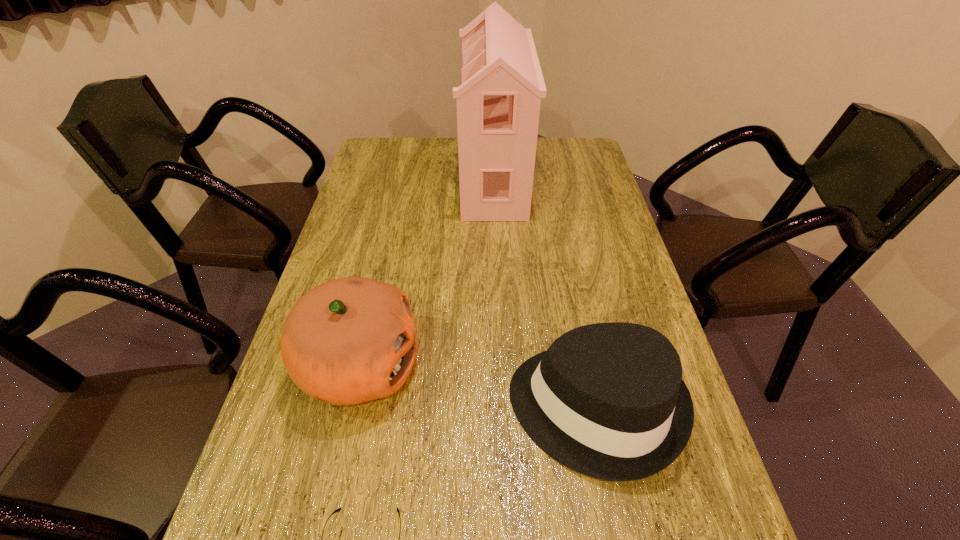
Locate an element on the screen. the tallest object is located at coordinates (498, 103).

In order to click on dollhouse in this screenshot , I will do `click(498, 103)`.

Find the location of `the second tallest object`. the second tallest object is located at coordinates (350, 340).

The height and width of the screenshot is (540, 960). Find the location of `fedora`. fedora is located at coordinates (607, 400).

Identify the location of vacant region located on the front-facing side of the tallest object. (401, 178).

Find the location of `vacant space located 0.340m on the front-facing side of the tallest object`. vacant space located 0.340m on the front-facing side of the tallest object is located at coordinates (365, 178).

Locate an element on the screen. vacant space situated on the front-facing side of the tallest object is located at coordinates (381, 178).

Where is `free space located on the face of the second tallest object`? Image resolution: width=960 pixels, height=540 pixels. free space located on the face of the second tallest object is located at coordinates (551, 366).

Identify the location of vacant point located 0.090m on the back of the fedora. The image size is (960, 540). (576, 316).

Where is `object that is positioned at the far edge`? object that is positioned at the far edge is located at coordinates (498, 103).